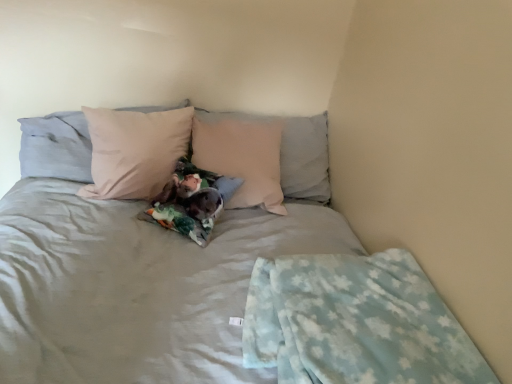
Question: Which direction should I rotate to look at light pink fabric pillow at center, acting as the 2th pillow starting from the left?

Choices:
 (A) left
 (B) right

Answer: (B)

Question: Is light pink fabric pillow at center, which appears as the first pillow when viewed from the right, located outside light blue fleece blanket at lower right?

Choices:
 (A) yes
 (B) no

Answer: (A)

Question: Is light blue fleece blanket at lower right inside light pink fabric pillow at center, which appears as the first pillow when viewed from the right?

Choices:
 (A) no
 (B) yes

Answer: (A)

Question: Is light pink fabric pillow at center, acting as the 2th pillow starting from the left, oriented away from light blue fleece blanket at lower right?

Choices:
 (A) yes
 (B) no

Answer: (B)

Question: From a real-world perspective, is light pink fabric pillow at center, which appears as the first pillow when viewed from the right, on light blue fleece blanket at lower right?

Choices:
 (A) yes
 (B) no

Answer: (A)

Question: From the image's perspective, is light pink fabric pillow at center, which appears as the first pillow when viewed from the right, under light blue fleece blanket at lower right?

Choices:
 (A) yes
 (B) no

Answer: (B)

Question: Can you confirm if light pink fabric pillow at center, acting as the 2th pillow starting from the left, is thinner than light blue fleece blanket at lower right?

Choices:
 (A) no
 (B) yes

Answer: (A)

Question: Is matte pink pillow at upper left, acting as the second pillow starting from the right, bigger than light blue fleece blanket at lower right?

Choices:
 (A) no
 (B) yes

Answer: (B)

Question: Is matte pink pillow at upper left, acting as the second pillow starting from the right, with light blue fleece blanket at lower right?

Choices:
 (A) yes
 (B) no

Answer: (B)

Question: Is matte pink pillow at upper left, acting as the second pillow starting from the right, to the right of light blue fleece blanket at lower right from the viewer's perspective?

Choices:
 (A) yes
 (B) no

Answer: (B)

Question: Is matte pink pillow at upper left, acting as the second pillow starting from the right, positioned far away from light blue fleece blanket at lower right?

Choices:
 (A) no
 (B) yes

Answer: (B)

Question: Is matte pink pillow at upper left, the 1th pillow viewed from the left, positioned behind light blue fleece blanket at lower right?

Choices:
 (A) yes
 (B) no

Answer: (A)

Question: Can you confirm if matte pink pillow at upper left, the 1th pillow viewed from the left, is shorter than light blue fleece blanket at lower right?

Choices:
 (A) no
 (B) yes

Answer: (A)

Question: Is light pink fabric pillow at center, which appears as the first pillow when viewed from the right, positioned with its back to matte pink pillow at upper left, the 1th pillow viewed from the left?

Choices:
 (A) no
 (B) yes

Answer: (B)